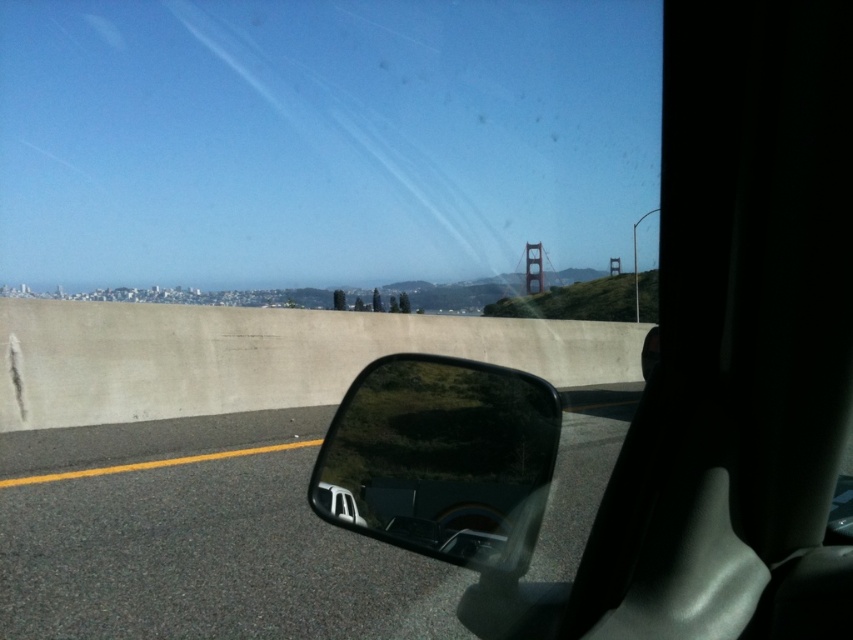
You are driving a car and want to know if you can safely pass an oncoming vehicle. The distance between the point at point (x=10, y=602) and the center of the road is 3.67 meters. Your car is 2 meters wide. Can you safely pass the oncoming vehicle without crossing the concrete barrier?

The distance between the point at point (x=10, y=602) and the center of the road is 3.67 meters. Since your car is 2 meters wide, you have enough space to safely pass the oncoming vehicle without crossing the concrete barrier.